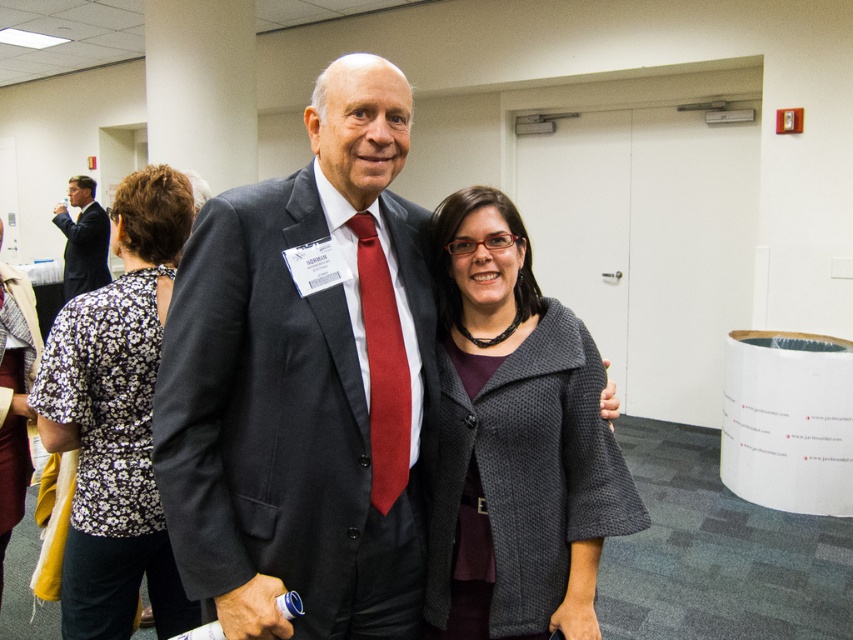
Between matte black suit at center and floral fabric blouse at left, which one is positioned higher?

matte black suit at center is above.

From the picture: Which is below, matte black suit at center or floral fabric blouse at left?

floral fabric blouse at left

You are a GUI agent. You are given a task and a screenshot of the screen. Output one action in this format:
    pyautogui.click(x=<x>, y=<y>)
    Task: Click on the matte black suit at center
    Image resolution: width=853 pixels, height=640 pixels.
    Given the screenshot: What is the action you would take?
    pyautogui.click(x=300, y=387)

Who is more forward, (407, 372) or (91, 180)?

Point (407, 372) is more forward.

Between matte red tie at center and matte black suit at left, which one appears on the right side from the viewer's perspective?

From the viewer's perspective, matte red tie at center appears more on the right side.

Who is more distant from viewer, (369, 372) or (82, 205)?

The point (82, 205) is behind.

This screenshot has width=853, height=640. I want to click on matte red tie at center, so click(383, 368).

Find the location of `dark gray textured coat at center`. dark gray textured coat at center is located at coordinates (515, 442).

Between point (525, 600) and point (144, 262), which one is positioned behind?

The point (144, 262) is behind.

You are a GUI agent. You are given a task and a screenshot of the screen. Output one action in this format:
    pyautogui.click(x=<x>, y=<y>)
    Task: Click on the dark gray textured coat at center
    This screenshot has height=640, width=853.
    Given the screenshot: What is the action you would take?
    point(515,442)